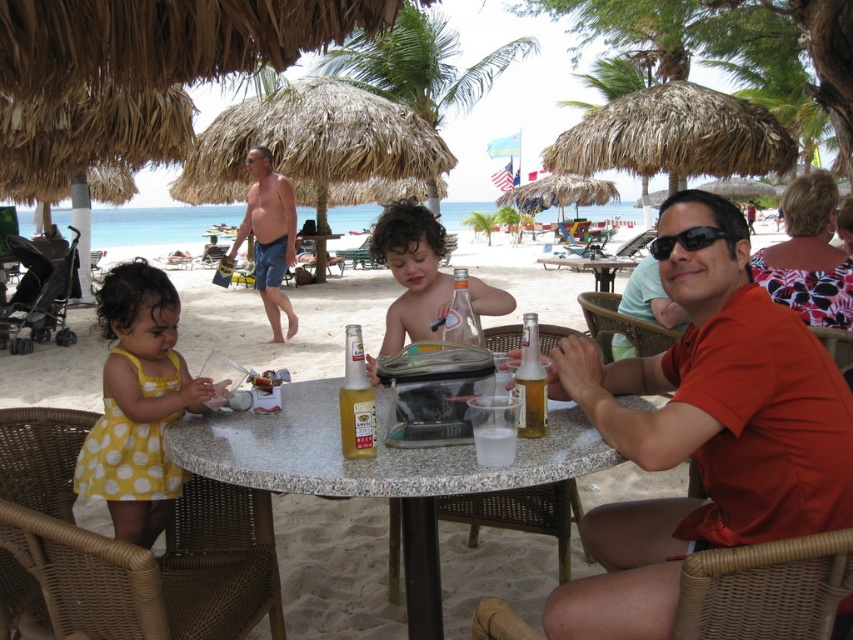
Question: Does matte orange shirt at center appear on the right side of white marble table at center?

Choices:
 (A) no
 (B) yes

Answer: (B)

Question: Can you confirm if yellow dotted dress at lower left is positioned below marble table at center?

Choices:
 (A) no
 (B) yes

Answer: (B)

Question: Which of these objects is positioned closest to the shiny metallic tray at center?

Choices:
 (A) yellow dotted dress at lower left
 (B) matte orange shirt at center
 (C) black plastic sunglasses at upper right

Answer: (B)

Question: Based on their relative distances, which object is nearer to the matte orange shirt at center?

Choices:
 (A) shiny blue shorts at center
 (B) black plastic sunglasses at upper right

Answer: (B)

Question: Which point is farther from the camera taking this photo?

Choices:
 (A) (405, 278)
 (B) (582, 579)
 (C) (329, 460)

Answer: (A)

Question: Can you confirm if yellow dotted dress at lower left is positioned to the left of shiny metallic tray at center?

Choices:
 (A) no
 (B) yes

Answer: (B)